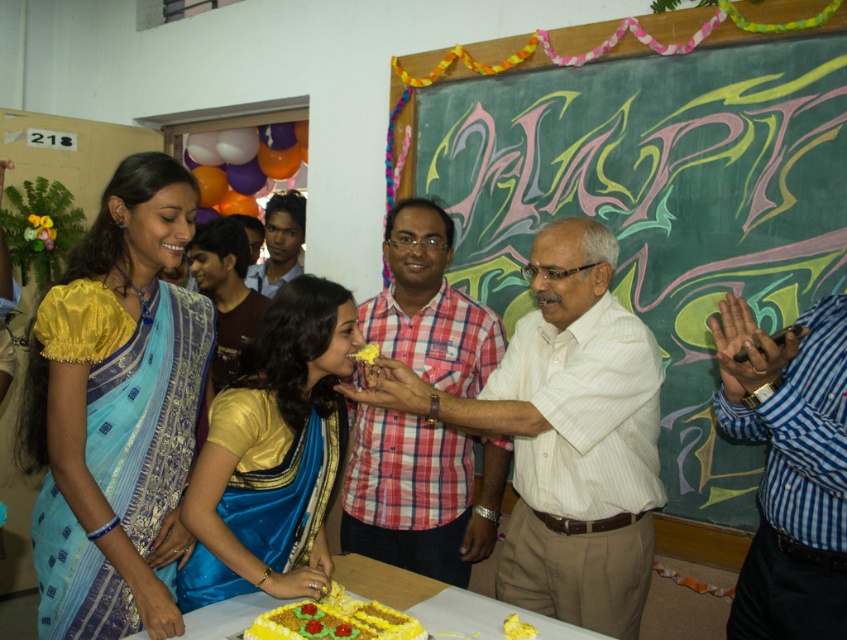
You are a photographer at the party and want to take a photo of both the green chalkboard at upper center and the silk saree at left. Which object should you focus on first to ensure both are in the frame?

You should focus on the silk saree at left first because the green chalkboard at upper center is positioned on the right side of it, so by centering the silk saree at left, the chalkboard will naturally be included in the frame to its right.

You are a photographer at the birthday party and want to ensure both the checkered fabric shirt at center and the matte brown hair at center are clearly visible in your photo. Which object should you focus on to ensure it doesn

The checkered fabric shirt at center is larger in size compared to the matte brown hair at center, so focusing on the checkered fabric shirt at center will ensure both are visible.